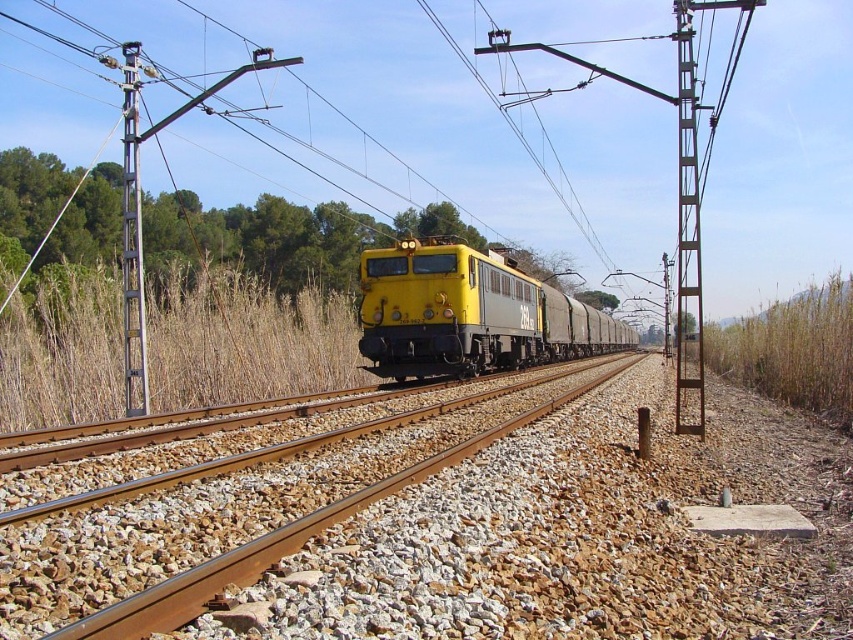
Between brown gravel track at center and green leafy tree at left, which one appears on the right side from the viewer's perspective?

brown gravel track at center

Does brown gravel track at center have a lesser width compared to green leafy tree at left?

Yes, brown gravel track at center is thinner than green leafy tree at left.

Who is more forward, (x=368, y=611) or (x=282, y=200)?

Positioned in front is point (x=368, y=611).

Identify the location of brown gravel track at center. The height and width of the screenshot is (640, 853). (271, 524).

Is yellow matte train at center smaller than brown metallic pole at right?

Yes.

Is yellow matte train at center taller than brown metallic pole at right?

No, yellow matte train at center is not taller than brown metallic pole at right.

You are a GUI agent. You are given a task and a screenshot of the screen. Output one action in this format:
    pyautogui.click(x=<x>, y=<y>)
    Task: Click on the yellow matte train at center
    This screenshot has width=853, height=640.
    Given the screenshot: What is the action you would take?
    pyautogui.click(x=467, y=314)

Locate an element on the screen. The width and height of the screenshot is (853, 640). yellow matte train at center is located at coordinates (467, 314).

Measure the distance from brown gravel track at center to brown metallic pole at right.

They are 18.92 meters apart.

Does brown gravel track at center have a smaller size compared to brown metallic pole at right?

Correct, brown gravel track at center occupies less space than brown metallic pole at right.

Between point (590, 376) and point (677, 182), which one is positioned behind?

Positioned behind is point (677, 182).

Locate an element on the screen. The width and height of the screenshot is (853, 640). brown gravel track at center is located at coordinates (271, 524).